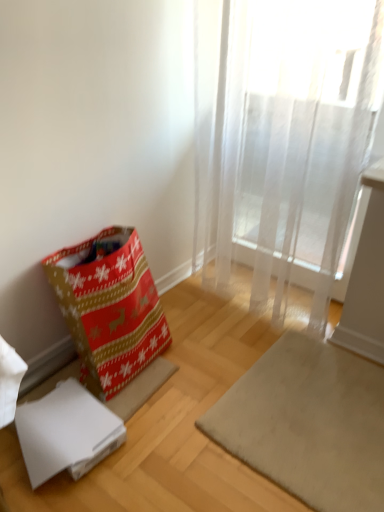
Question: Does christmas-patterned fabric gift bag at lower left turn towards white cardboard box at lower left?

Choices:
 (A) yes
 (B) no

Answer: (B)

Question: Is christmas-patterned fabric gift bag at lower left completely or partially outside of white cardboard box at lower left?

Choices:
 (A) no
 (B) yes

Answer: (B)

Question: Can you confirm if christmas-patterned fabric gift bag at lower left is positioned to the right of white cardboard box at lower left?

Choices:
 (A) no
 (B) yes

Answer: (B)

Question: Can you confirm if christmas-patterned fabric gift bag at lower left is taller than white cardboard box at lower left?

Choices:
 (A) yes
 (B) no

Answer: (A)

Question: Considering the relative sizes of christmas-patterned fabric gift bag at lower left and white cardboard box at lower left in the image provided, is christmas-patterned fabric gift bag at lower left thinner than white cardboard box at lower left?

Choices:
 (A) yes
 (B) no

Answer: (B)

Question: Considering the relative positions of christmas-patterned fabric gift bag at lower left and white cardboard box at lower left in the image provided, is christmas-patterned fabric gift bag at lower left in front of white cardboard box at lower left?

Choices:
 (A) no
 (B) yes

Answer: (B)

Question: From a real-world perspective, is white cardboard box at lower left under christmas-patterned fabric gift bag at lower left?

Choices:
 (A) no
 (B) yes

Answer: (B)

Question: Can you confirm if white cardboard box at lower left is positioned to the left of christmas-patterned fabric gift bag at lower left?

Choices:
 (A) yes
 (B) no

Answer: (A)

Question: Is white cardboard box at lower left outside christmas-patterned fabric gift bag at lower left?

Choices:
 (A) yes
 (B) no

Answer: (A)

Question: From the image's perspective, is white cardboard box at lower left beneath christmas-patterned fabric gift bag at lower left?

Choices:
 (A) yes
 (B) no

Answer: (A)

Question: Considering the relative sizes of white cardboard box at lower left and christmas-patterned fabric gift bag at lower left in the image provided, is white cardboard box at lower left taller than christmas-patterned fabric gift bag at lower left?

Choices:
 (A) yes
 (B) no

Answer: (B)

Question: Is christmas-patterned fabric gift bag at lower left surrounded by white cardboard box at lower left?

Choices:
 (A) yes
 (B) no

Answer: (B)

Question: Is white cardboard box at lower left far from translucent white curtain at upper right?

Choices:
 (A) yes
 (B) no

Answer: (A)